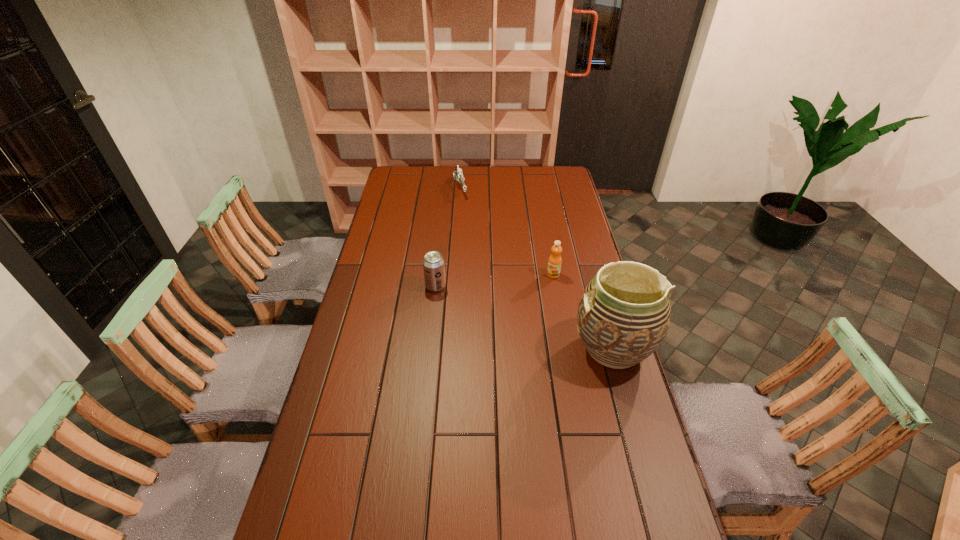
Where is `vacant region at the far left corner of the desktop`? The width and height of the screenshot is (960, 540). vacant region at the far left corner of the desktop is located at coordinates (413, 171).

The image size is (960, 540). What are the coordinates of `vacant region at the near right corner` in the screenshot? It's located at (669, 538).

Locate an element on the screen. The width and height of the screenshot is (960, 540). free space between the shortest object and the second nearest object is located at coordinates (447, 237).

Where is `unoccupied position between the pottery and the second nearest object`? The width and height of the screenshot is (960, 540). unoccupied position between the pottery and the second nearest object is located at coordinates pyautogui.click(x=524, y=317).

Identify the location of vacant area that lies between the pottery and the shortest object. The height and width of the screenshot is (540, 960). (537, 268).

Locate an element on the screen. This screenshot has width=960, height=540. unoccupied area between the pottery and the shortest object is located at coordinates [537, 268].

Where is `unoccupied area between the shortest object and the nearest object`? unoccupied area between the shortest object and the nearest object is located at coordinates (537, 268).

Identify the location of blank region between the third farthest object and the third nearest object. (494, 280).

Image resolution: width=960 pixels, height=540 pixels. Identify the location of unoccupied area between the farthest object and the second farthest object. (507, 231).

Where is `free spot between the orange juice and the gun`? This screenshot has width=960, height=540. free spot between the orange juice and the gun is located at coordinates (507, 231).